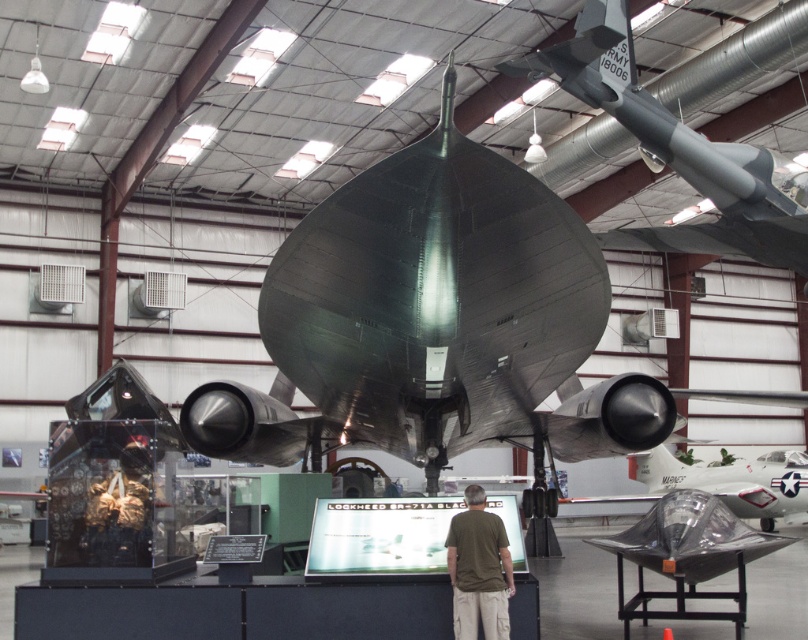
Question: Among these points, which one is farthest from the camera?

Choices:
 (A) (505, 600)
 (B) (684, 234)

Answer: (B)

Question: Does matte gray missile at upper right have a larger size compared to dark green t-shirt at center?

Choices:
 (A) no
 (B) yes

Answer: (B)

Question: Is matte gray missile at upper right to the right of dark green t-shirt at center from the viewer's perspective?

Choices:
 (A) no
 (B) yes

Answer: (B)

Question: Is matte gray missile at upper right further to camera compared to dark green t-shirt at center?

Choices:
 (A) no
 (B) yes

Answer: (B)